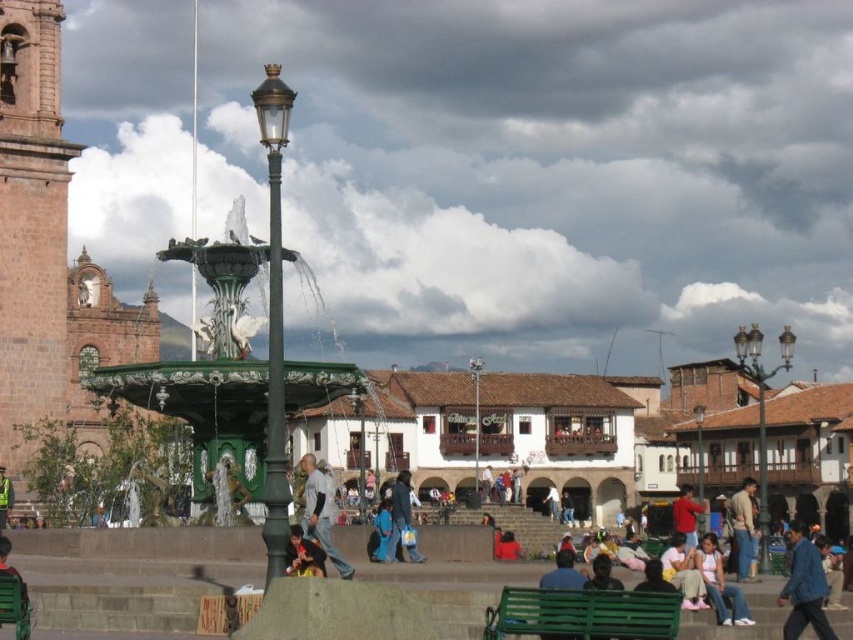
Question: Is polished brass streetlight at upper right behind dark blue shirt at center?

Choices:
 (A) yes
 (B) no

Answer: (A)

Question: Estimate the real-world distances between objects in this image. Which object is closer to the blue denim jacket at lower right?

Choices:
 (A) green plastic bench at lower left
 (B) reflective green vest at lower left
 (C) dark blue fabric jacket at center

Answer: (C)

Question: Which point is farther from the camera taking this photo?

Choices:
 (A) (x=306, y=556)
 (B) (x=376, y=541)
 (C) (x=747, y=496)
 (D) (x=1, y=563)

Answer: (C)

Question: Does polished brass streetlight at upper right lie behind blue fabric dress at center?

Choices:
 (A) no
 (B) yes

Answer: (B)

Question: Can you confirm if green painted wood bench at lower center is positioned to the right of dark blue jeans at center?

Choices:
 (A) no
 (B) yes

Answer: (B)

Question: Which point appears closest to the camera in this image?

Choices:
 (A) (318, 561)
 (B) (784, 596)
 (C) (322, 470)
 (D) (519, 550)

Answer: (A)